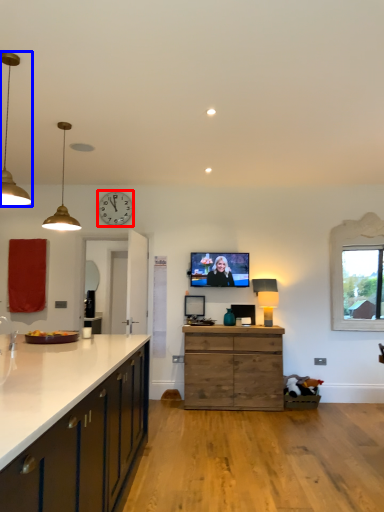
Question: Which object appears farthest to the camera in this image, clock (highlighted by a red box) or lamp (highlighted by a blue box)?

Choices:
 (A) clock
 (B) lamp

Answer: (A)